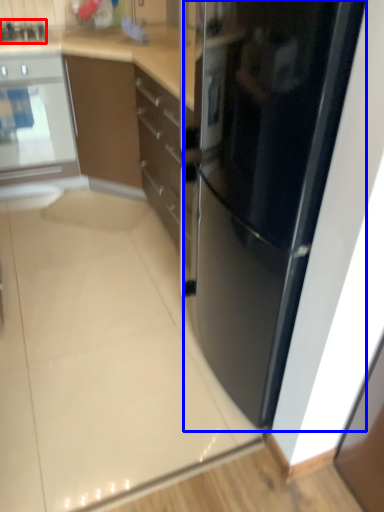
Question: Which object is further to the camera taking this photo, appliance (highlighted by a red box) or refrigerator (highlighted by a blue box)?

Choices:
 (A) appliance
 (B) refrigerator

Answer: (A)